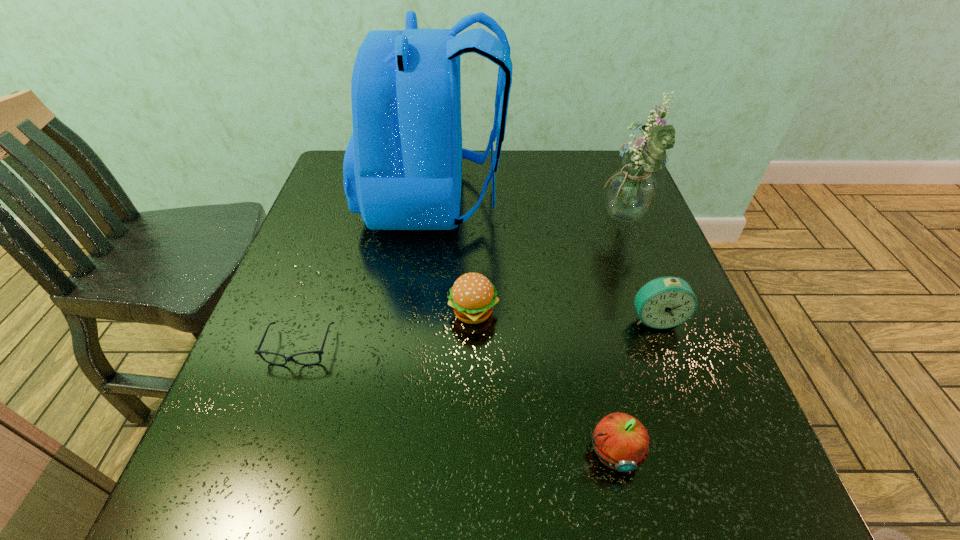
Where is `backpack`? This screenshot has height=540, width=960. backpack is located at coordinates (402, 168).

Locate an element on the screen. The image size is (960, 540). bouquet is located at coordinates pyautogui.click(x=630, y=191).

This screenshot has height=540, width=960. I want to click on alarm clock, so click(665, 302).

Find the location of a particular element. This screenshot has width=960, height=540. the third object from right to left is located at coordinates (621, 442).

The width and height of the screenshot is (960, 540). Find the location of `apple`. apple is located at coordinates (621, 442).

Find the location of a particular element. The width and height of the screenshot is (960, 540). hamburger is located at coordinates (472, 296).

Find the location of a particular element. the shortest object is located at coordinates (287, 359).

Locate an element on the screen. Image resolution: width=960 pixels, height=540 pixels. vacant space located 0.220m on the back of the backpack is located at coordinates (588, 200).

I want to click on free space located on the front-facing side of the bouquet, so click(x=536, y=221).

Locate an element on the screen. free space located on the front-facing side of the bouquet is located at coordinates (532, 221).